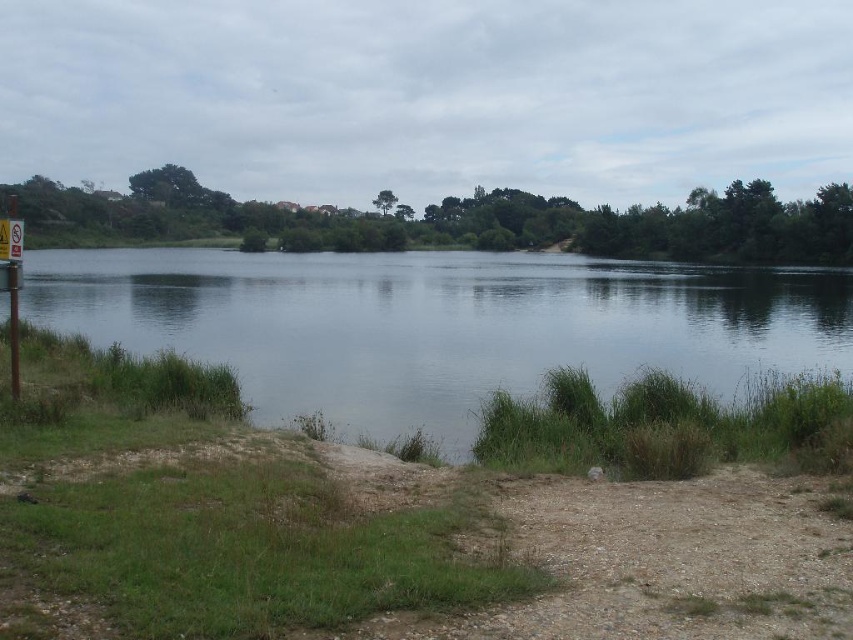
You are standing on the dirt path and want to walk to the clear water at center. The metal sign at left is in your way. Can you walk around it without stepping into the water?

The clear water at center has a greater height compared to the metal sign at left, so the metal sign at left is lower. You can walk around the metal sign at left by stepping onto the higher clear water at center.

You are standing on the dirt path leading to the lake. There is a point marked at coordinates (440, 324). What is located at that point?

The point at coordinates (440, 324) is marked as clear water at center.